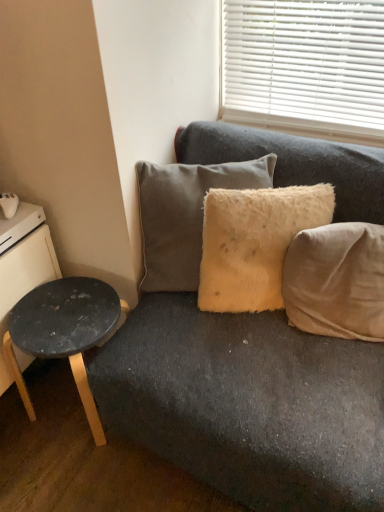
Question: Is the depth of white glossy drawer at left greater than that of fuzzy yellow pillow at center, marked as the 2th pillow in a left-to-right arrangement?

Choices:
 (A) yes
 (B) no

Answer: (A)

Question: Is white glossy drawer at left facing away from fuzzy yellow pillow at center, marked as the 2th pillow in a left-to-right arrangement?

Choices:
 (A) no
 (B) yes

Answer: (A)

Question: Is white glossy drawer at left in contact with fuzzy yellow pillow at center, marked as the 2th pillow in a left-to-right arrangement?

Choices:
 (A) no
 (B) yes

Answer: (A)

Question: Is white glossy drawer at left far from fuzzy yellow pillow at center, marked as the 2th pillow in a left-to-right arrangement?

Choices:
 (A) no
 (B) yes

Answer: (A)

Question: Is white glossy drawer at left positioned beyond the bounds of fuzzy yellow pillow at center, the 2th pillow when ordered from right to left?

Choices:
 (A) yes
 (B) no

Answer: (A)

Question: Considering the relative sizes of white glossy drawer at left and fuzzy yellow pillow at center, the 2th pillow when ordered from right to left, in the image provided, is white glossy drawer at left smaller than fuzzy yellow pillow at center, the 2th pillow when ordered from right to left,?

Choices:
 (A) no
 (B) yes

Answer: (B)

Question: From the image's perspective, would you say beige fabric pillow at right, which is counted as the 1th pillow, starting from the right, is positioned over fuzzy yellow pillow at center, the 2th pillow when ordered from right to left?

Choices:
 (A) yes
 (B) no

Answer: (B)

Question: From a real-world perspective, is beige fabric pillow at right, acting as the 3th pillow starting from the left, beneath fuzzy yellow pillow at center, the 2th pillow when ordered from right to left?

Choices:
 (A) no
 (B) yes

Answer: (B)

Question: Does beige fabric pillow at right, which is counted as the 1th pillow, starting from the right, have a lesser height compared to fuzzy yellow pillow at center, the 2th pillow when ordered from right to left?

Choices:
 (A) yes
 (B) no

Answer: (A)

Question: From the image's perspective, does beige fabric pillow at right, which is counted as the 1th pillow, starting from the right, appear lower than fuzzy yellow pillow at center, the 2th pillow when ordered from right to left?

Choices:
 (A) yes
 (B) no

Answer: (A)

Question: Considering the relative positions of beige fabric pillow at right, which is counted as the 1th pillow, starting from the right, and fuzzy yellow pillow at center, the 2th pillow when ordered from right to left, in the image provided, is beige fabric pillow at right, which is counted as the 1th pillow, starting from the right, to the left of fuzzy yellow pillow at center, the 2th pillow when ordered from right to left, from the viewer's perspective?

Choices:
 (A) no
 (B) yes

Answer: (A)

Question: Can you confirm if beige fabric pillow at right, acting as the 3th pillow starting from the left, is bigger than fuzzy yellow pillow at center, marked as the 2th pillow in a left-to-right arrangement?

Choices:
 (A) no
 (B) yes

Answer: (A)

Question: Is black wood dresser at left facing away from beige fabric pillow at right, acting as the 3th pillow starting from the left?

Choices:
 (A) yes
 (B) no

Answer: (B)